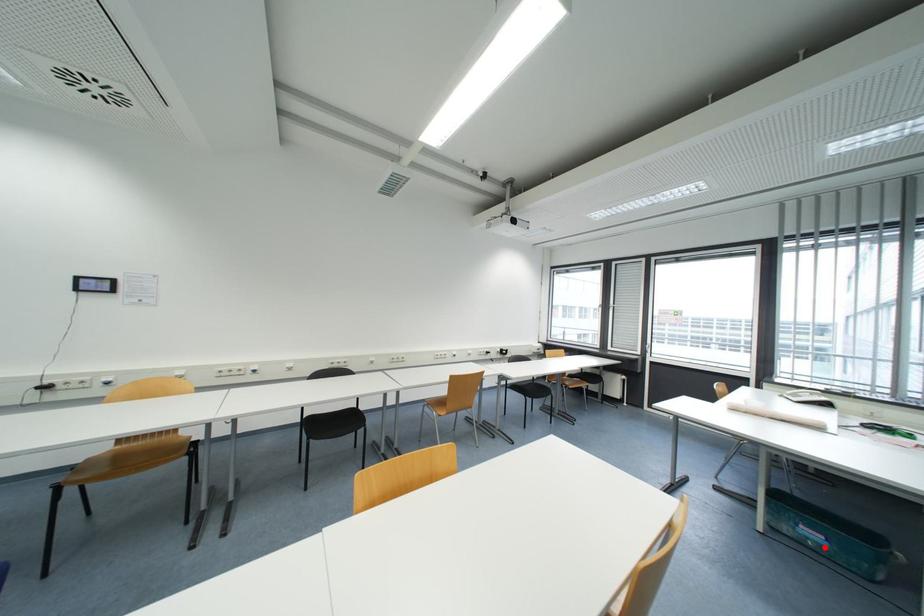
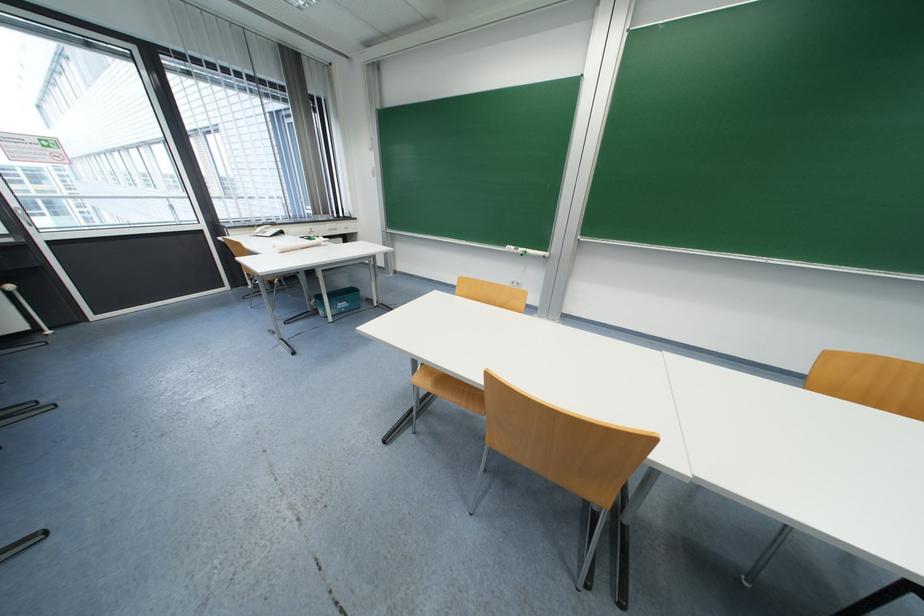
In the second image, find the point that corresponds to the highlighted location in the first image.

(350, 310)